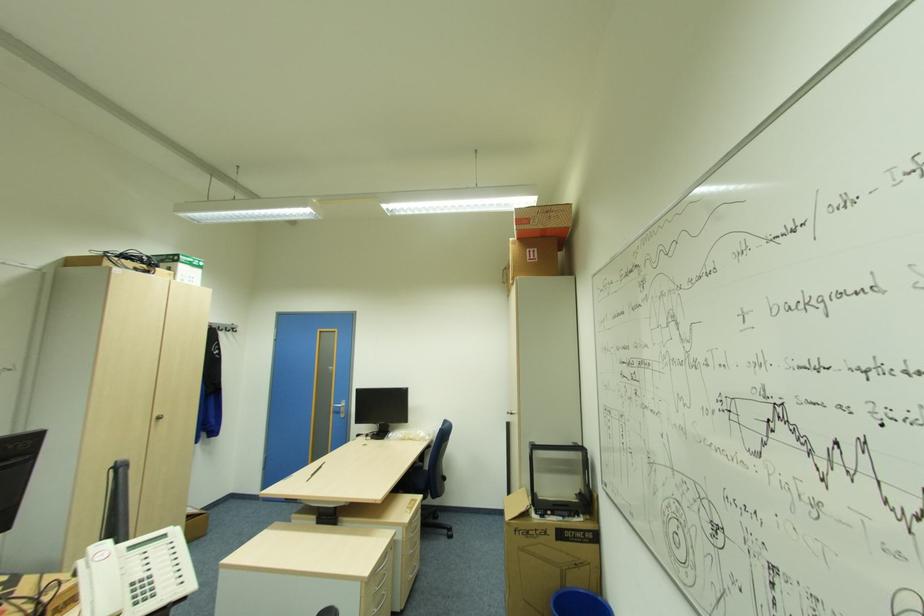
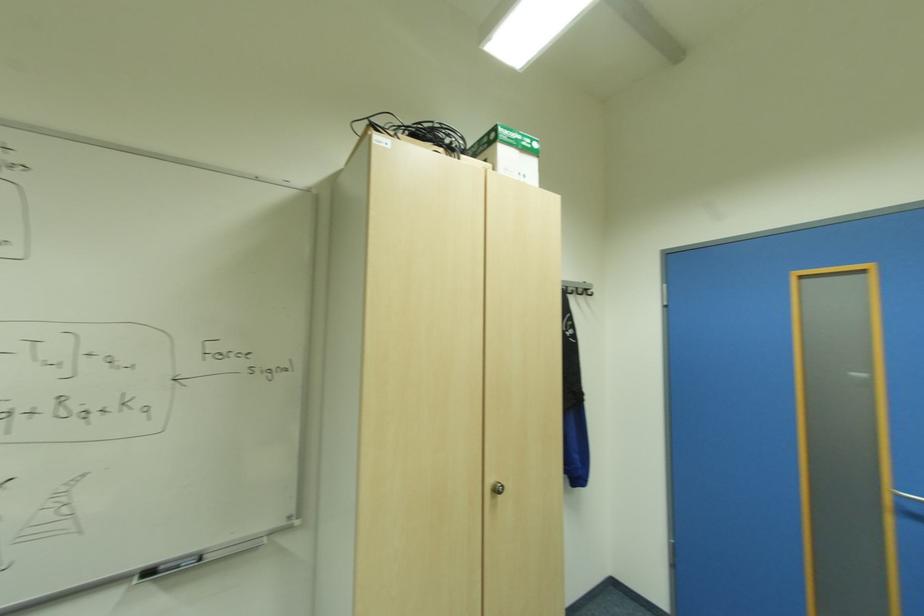
Find the pixel in the second image that matches (201,262) in the first image.

(533, 140)